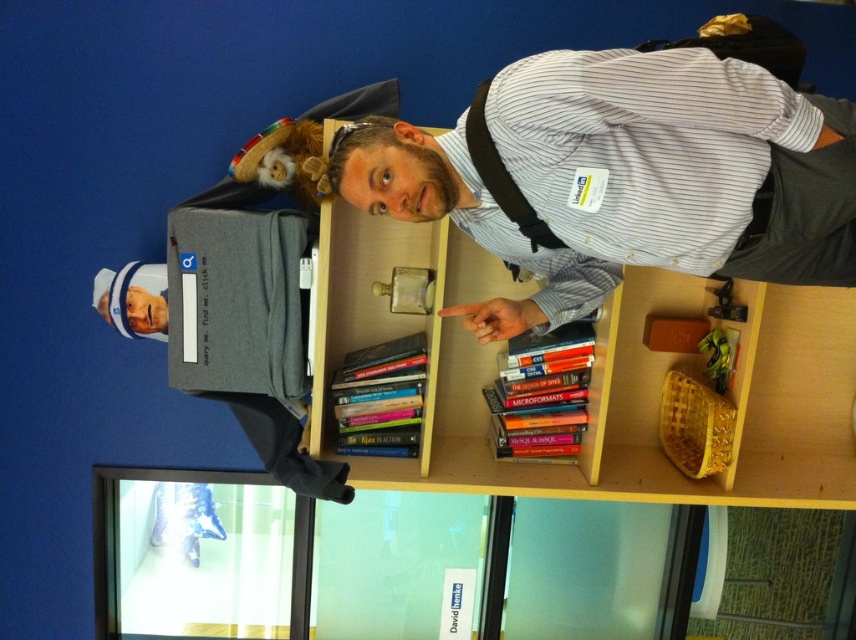
You are taking a photo of the shelf and notice two points on it. The first point is at coordinates point (465, 152) and the second is at point (450, 296). Which point is closer to your camera lens?

Point (465, 152) is closer to the camera than point (450, 296).